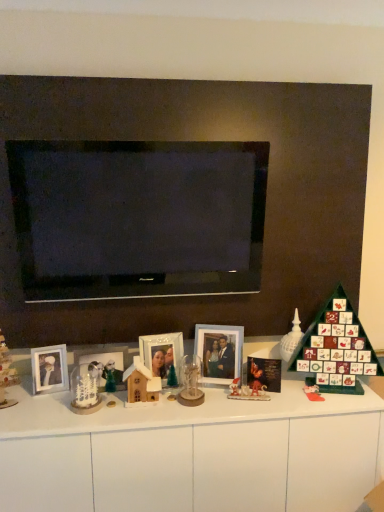
Locate an element on the screen. The width and height of the screenshot is (384, 512). vacant area that lies between wooden house at center, the third toy viewed from the back, and clear glass candle holder at center, which is the 1th candle holder in right-to-left order is located at coordinates (159, 405).